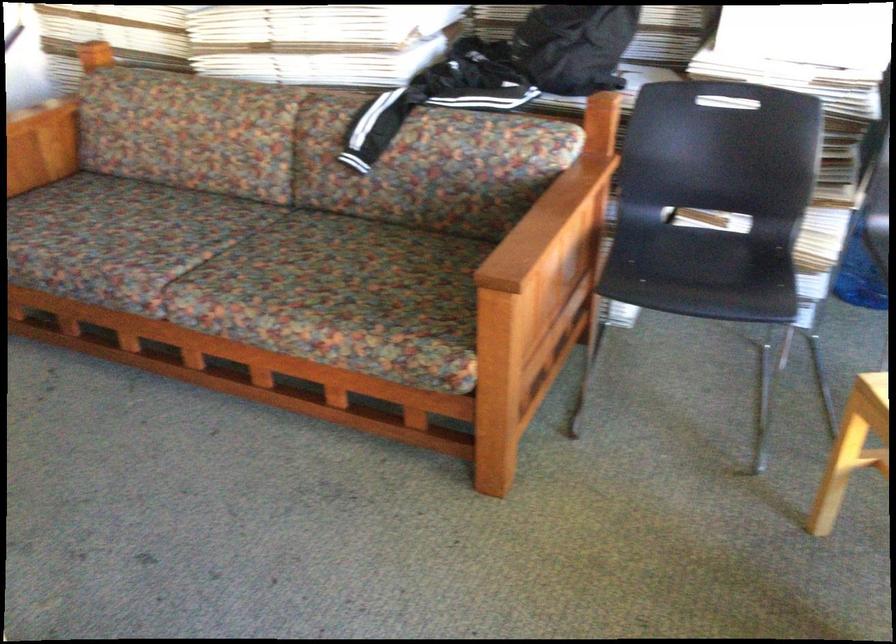
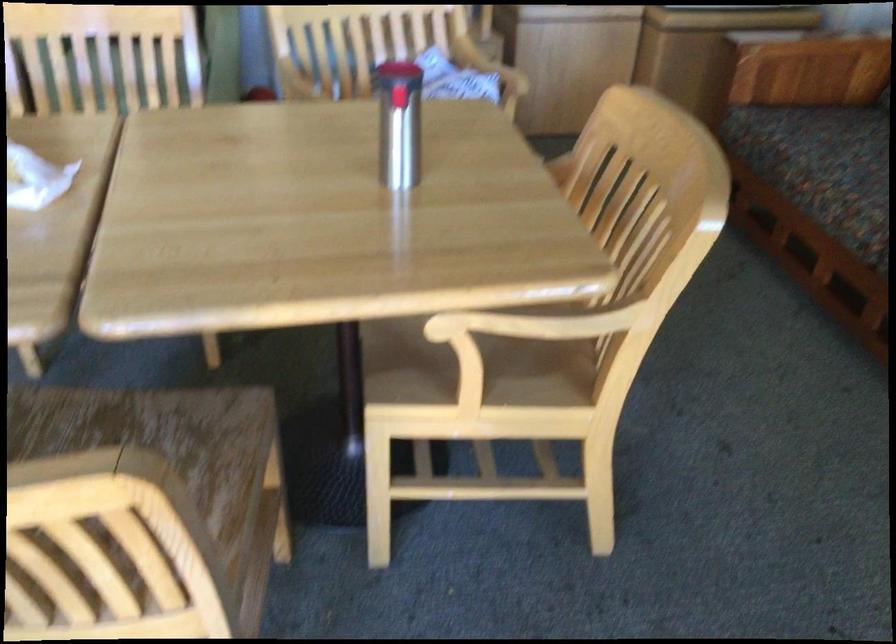
Question: The camera is either moving clockwise (left) or counter-clockwise (right) around the object. The first image is from the beginning of the video and the second image is from the end. Is the camera moving left or right when shooting the video?

Choices:
 (A) Left
 (B) Right

Answer: (B)